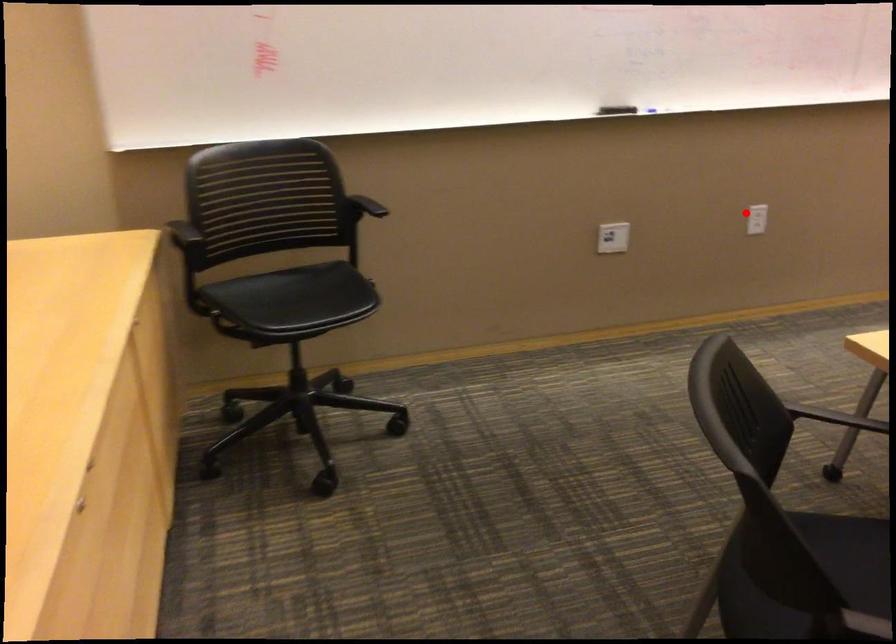
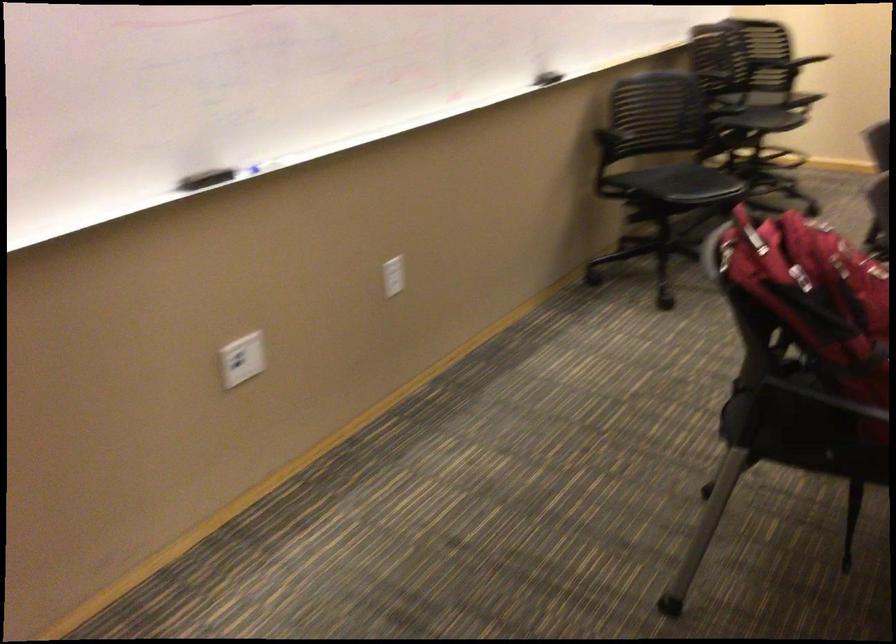
Find the pixel in the second image that matches the highlighted location in the first image.

(392, 276)